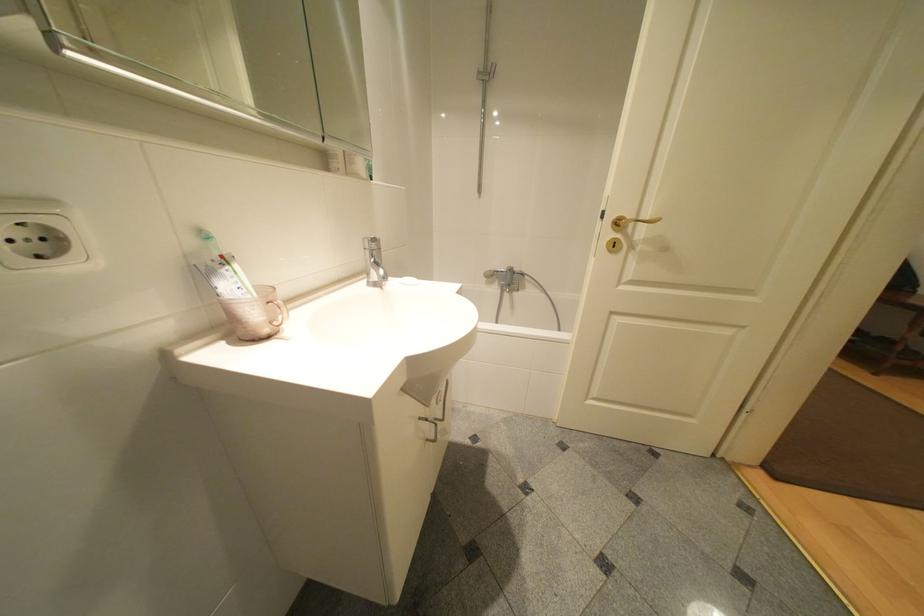
Where is `cup handle`? cup handle is located at coordinates (278, 312).